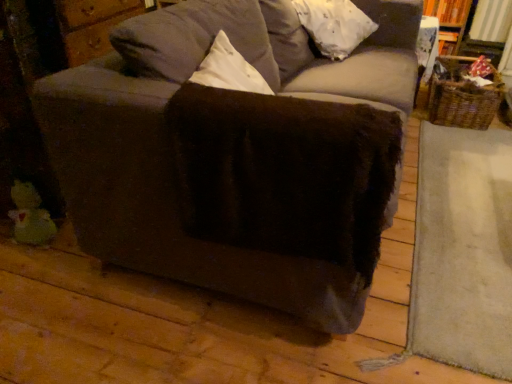
Question: Is green plush duck at lower left situated inside white fluffy pillow at upper center or outside?

Choices:
 (A) outside
 (B) inside

Answer: (A)

Question: From the image's perspective, relative to white fluffy pillow at upper center, is green plush duck at lower left above or below?

Choices:
 (A) above
 (B) below

Answer: (B)

Question: Based on their relative distances, which object is nearer to the velvet gray couch at center?

Choices:
 (A) green plush duck at lower left
 (B) white fluffy pillow at upper center
 (C) woven brown basket at right

Answer: (B)

Question: Estimate the real-world distances between objects in this image. Which object is closer to the green plush duck at lower left?

Choices:
 (A) white fluffy pillow at upper center
 (B) woven brown basket at right
 (C) velvet gray couch at center

Answer: (C)